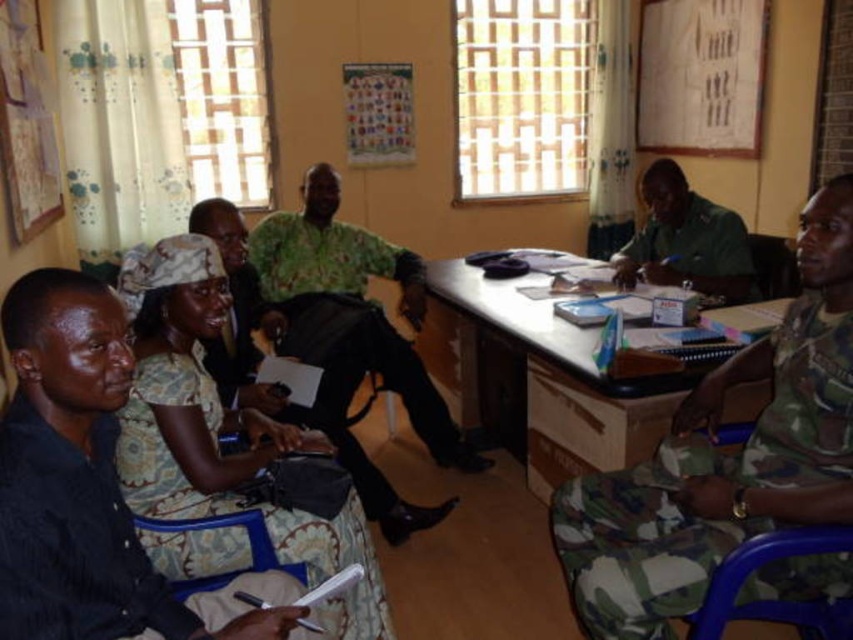
You are a photographer positioned at the back of the room. You want to take a photo that includes both the black matte shirt at lower left and the blue plastic chair at lower right. Which object should you adjust your camera angle to focus on first to ensure both are in frame?

The black matte shirt at lower left is closer to the viewer than the blue plastic chair at lower right, so focus on the black matte shirt at lower left first to ensure both are in frame.

You are organizing a meeting in this room and need to seat everyone comfortably. The camouflage uniform at right and the blue fabric chair at lower left are two items you have. Which object is wider, and would it be better to place the wider one where more space is needed?

The camouflage uniform at right is wider than the blue fabric chair at lower left. It would be better to place the wider camouflage uniform at right in the area where more space is required.

You are organizing a meeting in this room and need to seat someone in the blue fabric chair at lower left. However, there is a camouflage uniform at right currently occupying it. What should you do to make space for the person?

The camouflage uniform at right is positioned over the blue fabric chair at lower left, so you should move the camouflage uniform at right off the blue fabric chair at lower left to make space.